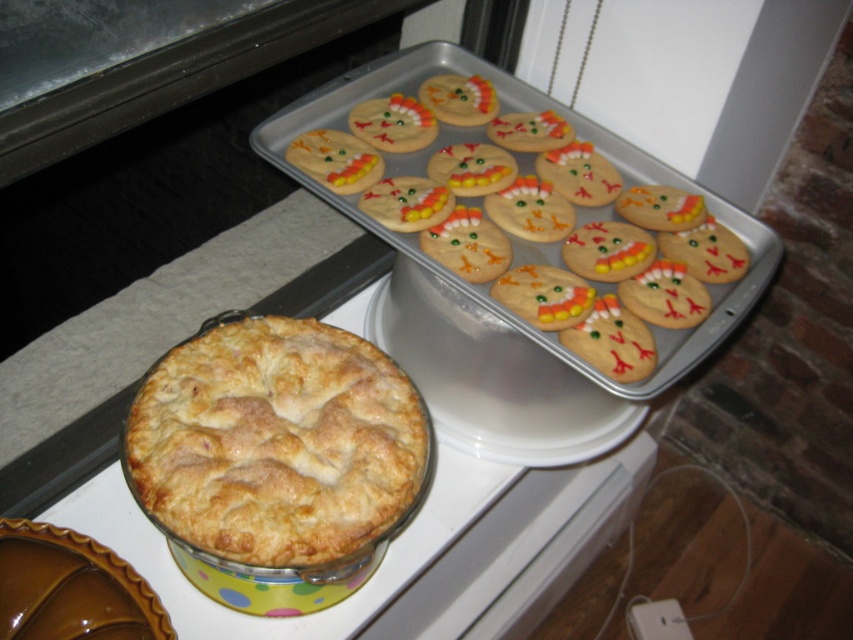
Question: Is golden sugar cookies at upper right positioned behind golden flaky pie at center?

Choices:
 (A) yes
 (B) no

Answer: (A)

Question: From the image, what is the correct spatial relationship of golden sugar cookies at upper right in relation to golden flaky pie at center?

Choices:
 (A) left
 (B) right

Answer: (B)

Question: Which object is closer to the camera taking this photo?

Choices:
 (A) golden sugar cookies at upper right
 (B) golden flaky pie at center

Answer: (B)

Question: Is golden sugar cookies at upper right to the left of golden flaky pie at center from the viewer's perspective?

Choices:
 (A) no
 (B) yes

Answer: (A)